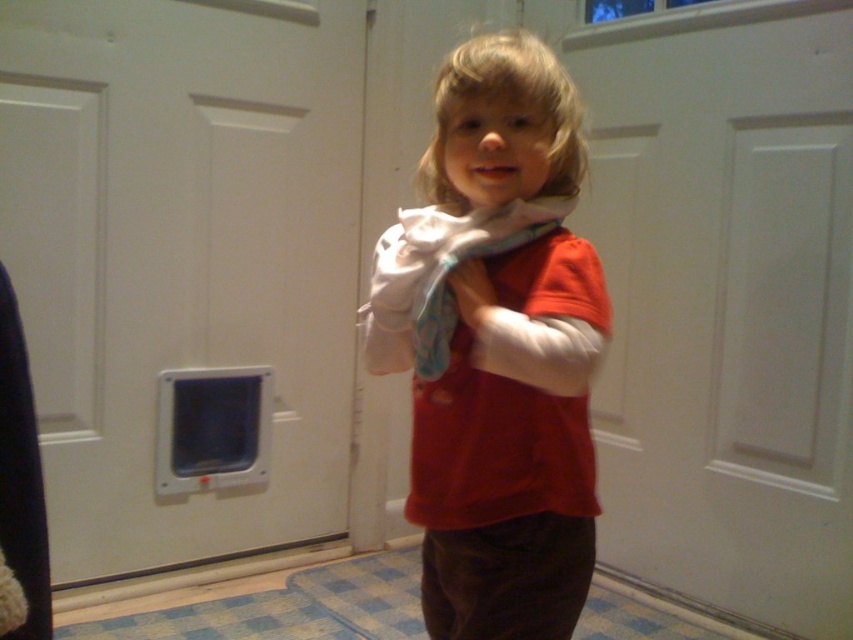
You are a fashion designer who wants to create a new outfit for the child in the image. The child has a matte red shirt at center and a white soft scarf at center. Which item is closer to the camera? Please answer based on their positions in the image.

Both the matte red shirt at center and white soft scarf at center are positioned at the same central area, so their distance to the camera is equal.

You are a delivery person trying to reach the door with the pet door. You see two points marked on the floor. The first point is at position point (x=412, y=428) and the second point is at point (x=509, y=230). Which point should you step on to get closer to the door?

You should step on point (x=509, y=230) because it is closer to the door than point (x=412, y=428), which is behind it.

From the picture: The child is standing near a door with a pet door. The child is wearing a red long sleeved shirt over a white long sleeved shirt. There is a point at coordinates (511,445). What is the color of the clothing item at that point?

The point at coordinates (511,445) corresponds to the matte red shirt at center, so the clothing item there is red.